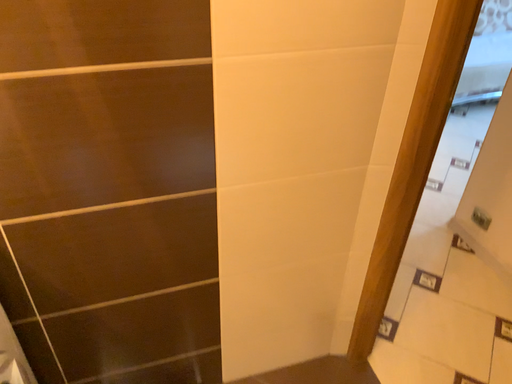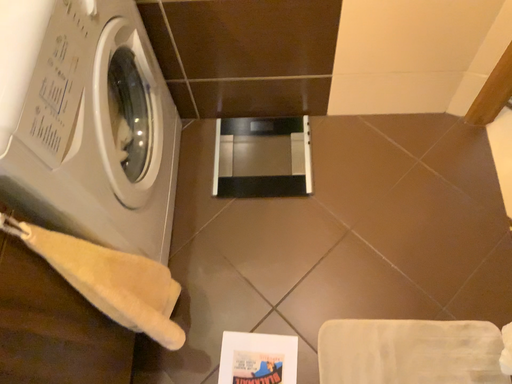
Question: How did the camera likely rotate when shooting the video?

Choices:
 (A) rotated upward
 (B) rotated downward

Answer: (B)